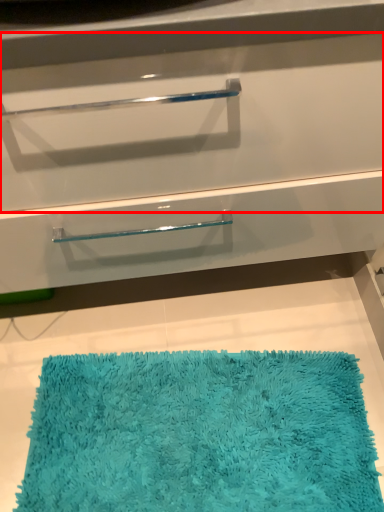
Question: In this image, where is drawer (annotated by the red box) located relative to bath mat?

Choices:
 (A) left
 (B) right

Answer: (A)